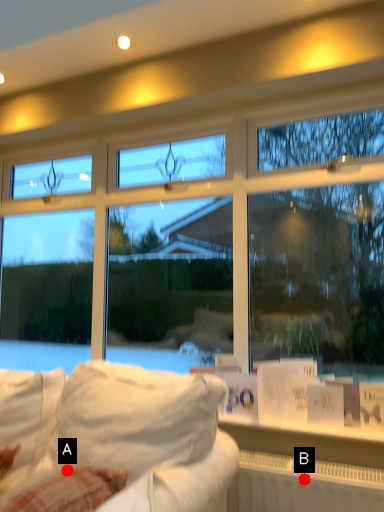
Question: Two points are circled on the image, labeled by A and B beside each circle. Among these points, which one is nearest to the camera?

Choices:
 (A) A is closer
 (B) B is closer

Answer: (A)